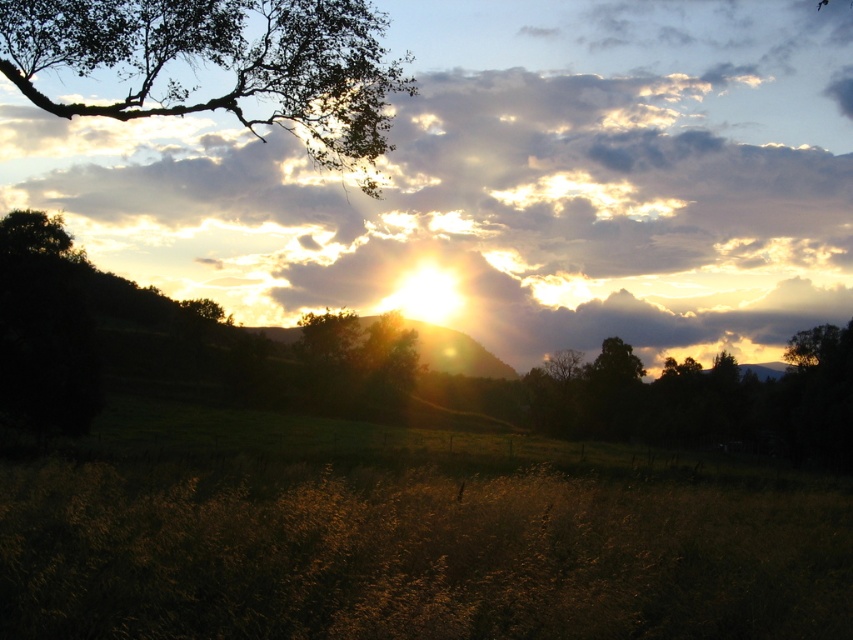
Question: Which is nearer to the green matte tree at center?

Choices:
 (A) cloudy sky at upper center
 (B) brown textured tree at center

Answer: (B)

Question: Among these points, which one is nearest to the camera?

Choices:
 (A) (570, 349)
 (B) (381, 353)
 (C) (721, 154)

Answer: (B)

Question: Does cloudy sky at upper center appear on the right side of brown textured tree at center?

Choices:
 (A) yes
 (B) no

Answer: (B)

Question: From the image, what is the correct spatial relationship of cloudy sky at upper center in relation to brown textured tree at center?

Choices:
 (A) below
 (B) above

Answer: (B)

Question: Which of the following is the closest to the observer?

Choices:
 (A) brown textured tree at center
 (B) cloudy sky at upper center

Answer: (A)

Question: Is green matte tree at center positioned in front of brown textured tree at center?

Choices:
 (A) yes
 (B) no

Answer: (A)